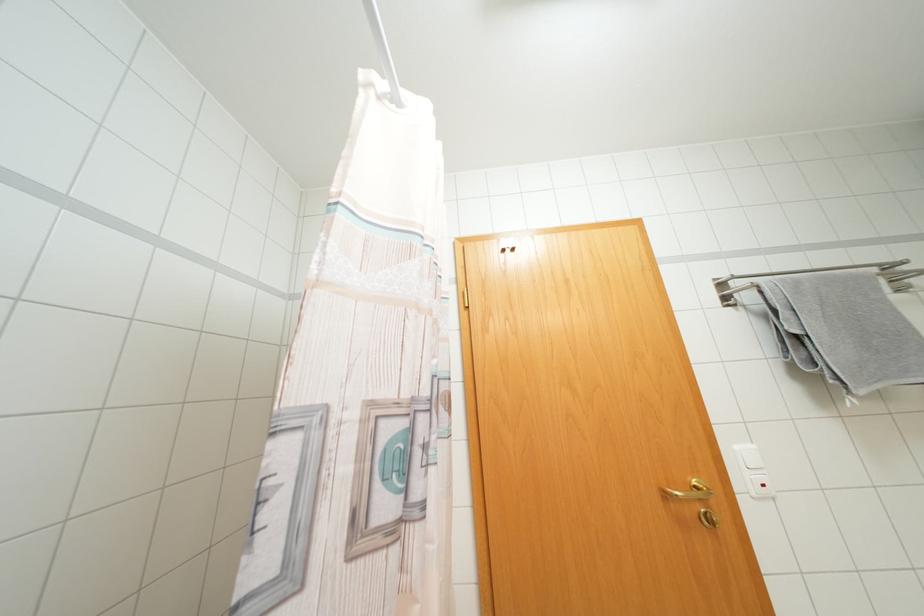
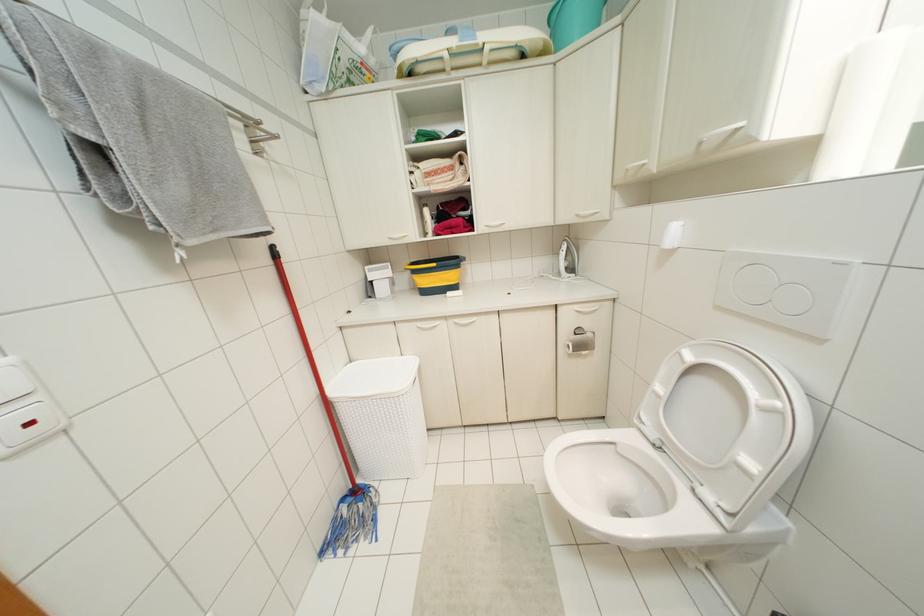
Question: I am providing you with two images of the same scene from different viewpoints. Which of the following objects are not visible in image2?

Choices:
 (A) toilet flush button
 (B) small ironing board
 (C) white light switch
 (D) none of these

Answer: (D)